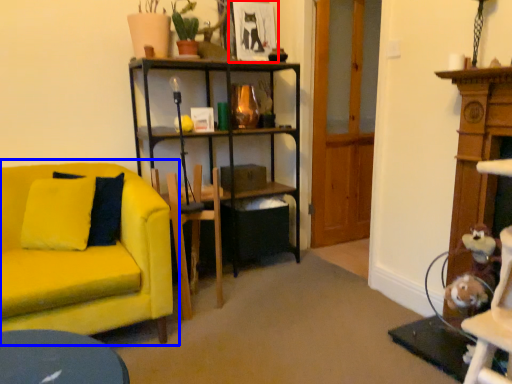
Question: Which of the following is the closest to the observer, picture frame (highlighted by a red box) or studio couch (highlighted by a blue box)?

Choices:
 (A) picture frame
 (B) studio couch

Answer: (B)